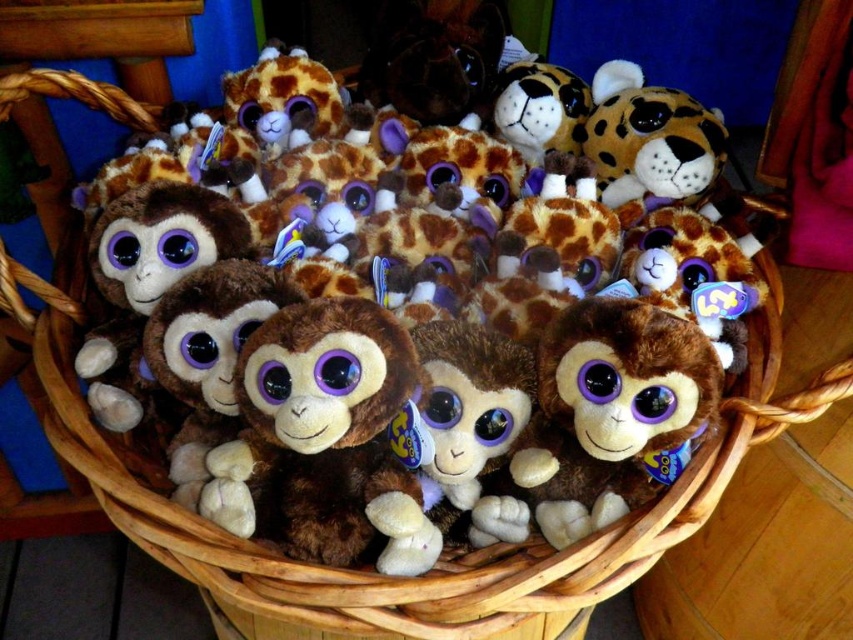
You are a child trying to stack the brown plush monkey at center and the spotted brown plush at upper right on top of each other. Which one should you place at the bottom to make the stack stable?

The brown plush monkey at center is much taller than the spotted brown plush at upper right, so placing the taller brown plush monkey at center at the bottom will provide a more stable base for the stack.

You are standing in front of the basket of plush toys and want to touch the point at point (657, 328) and point (592, 112). Which point will you reach first?

Point (657, 328) is closer to the camera than point (592, 112), so you will reach point (657, 328) first.

You are a child trying to reach for the spotted brown plush at upper right in the basket. The brown plush monkey at center is blocking your view. Can you tell which toy is closer to you?

The brown plush monkey at center is closer to the viewer than the spotted brown plush at upper right, so the brown plush monkey at center is blocking your view.